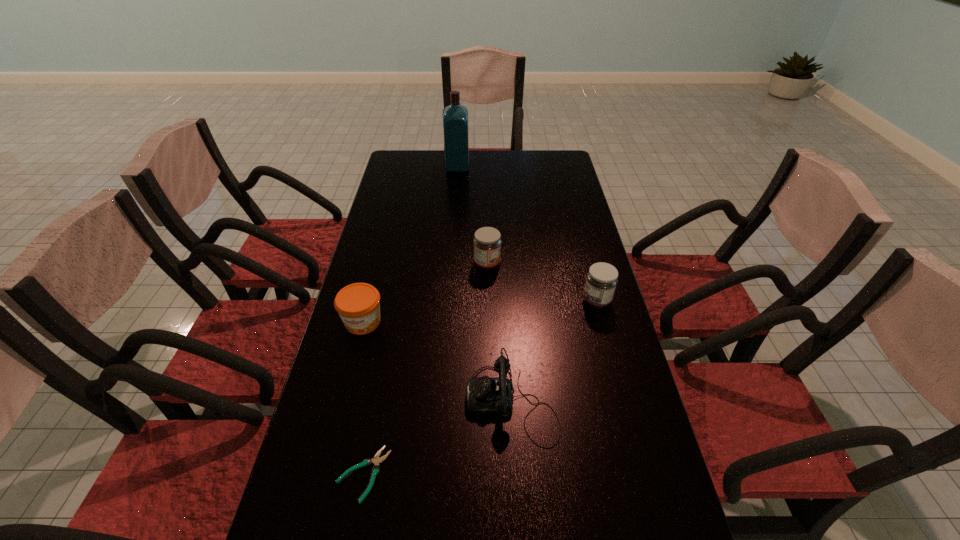
Locate an element on the screen. Image resolution: width=960 pixels, height=540 pixels. the farthest object is located at coordinates (455, 117).

Image resolution: width=960 pixels, height=540 pixels. In order to click on the tallest object in this screenshot , I will do `click(455, 117)`.

In order to click on the second jam from left to right in this screenshot , I will do `click(487, 243)`.

Locate an element on the screen. This screenshot has height=540, width=960. the farthest jam is located at coordinates (487, 243).

Where is `the rightmost object`? This screenshot has height=540, width=960. the rightmost object is located at coordinates (602, 278).

This screenshot has width=960, height=540. What are the coordinates of `the shortest jam` in the screenshot? It's located at (358, 304).

Where is `telephone`? The width and height of the screenshot is (960, 540). telephone is located at coordinates coord(485,396).

Find the location of a particular element. Image resolution: width=960 pixels, height=540 pixels. pliers is located at coordinates (376, 460).

Find the location of a particular element. The image size is (960, 540). free location located on the flat label side of the tallest object is located at coordinates (556, 167).

What are the coordinates of `blank area located on the left of the fifth nearest object` in the screenshot? It's located at (375, 265).